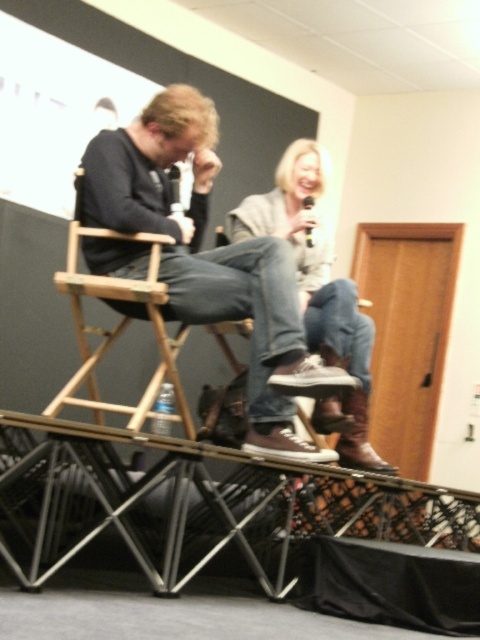
Between matte black sneakers at center and wooden director's chair at left, which one has less height?

wooden director's chair at left is shorter.

Is matte black sneakers at center to the left of wooden director's chair at left from the viewer's perspective?

In fact, matte black sneakers at center is to the right of wooden director's chair at left.

Does point (276, 372) lie in front of point (133, 406)?

Yes.

Identify the location of matte black sneakers at center. (210, 259).

Who is lower down, denim jeans at center or wooden director's chair at left?

wooden director's chair at left is lower down.

Is denim jeans at center further to camera compared to wooden director's chair at left?

Yes, it is.

Is point (343, 419) in front of point (120, 321)?

Yes.

Identify the location of denim jeans at center. The image size is (480, 640). (317, 292).

Who is lower down, matte black sneakers at center or denim jeans at center?

denim jeans at center

Is point (297, 308) positioned behind point (312, 161)?

That is False.

Find the location of a particular element. matte black sneakers at center is located at coordinates (210, 259).